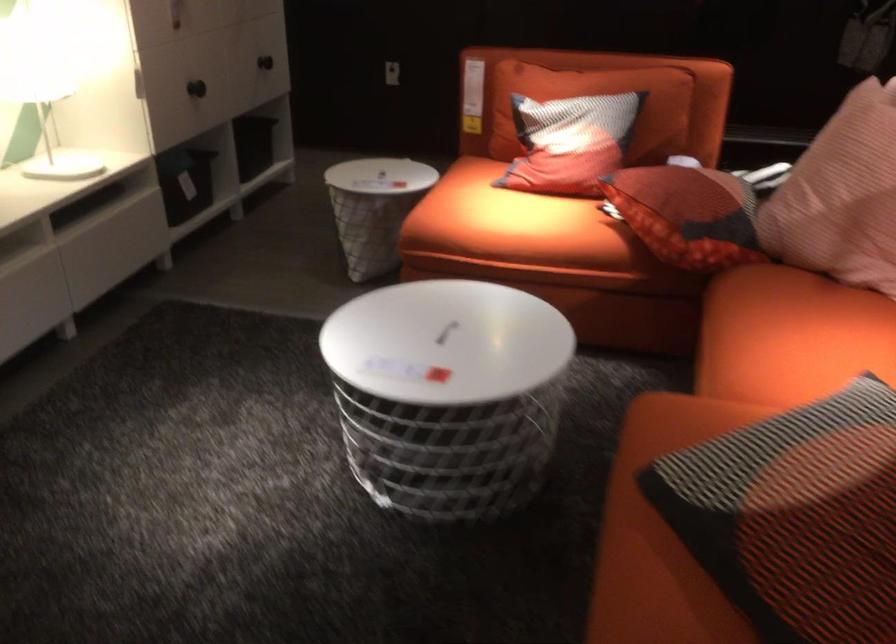
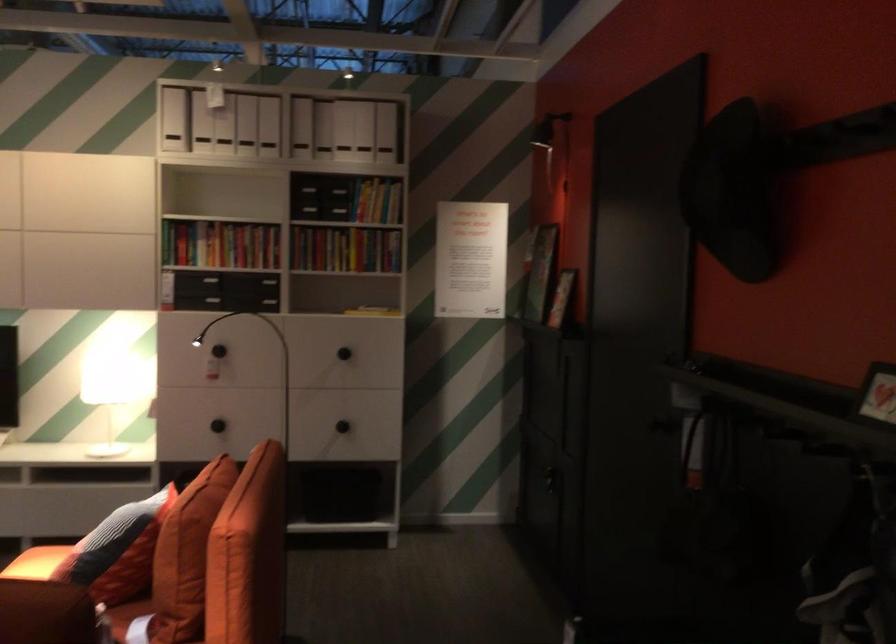
In the second image, find the point that corresponds to point 694,91 in the first image.

(186, 554)